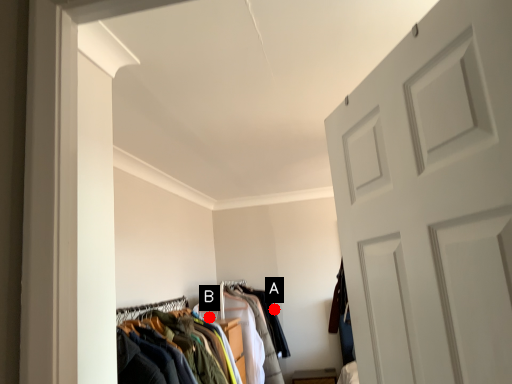
Question: Two points are circled on the image, labeled by A and B beside each circle. Which point is closer to the camera taking this photo?

Choices:
 (A) A is closer
 (B) B is closer

Answer: (B)